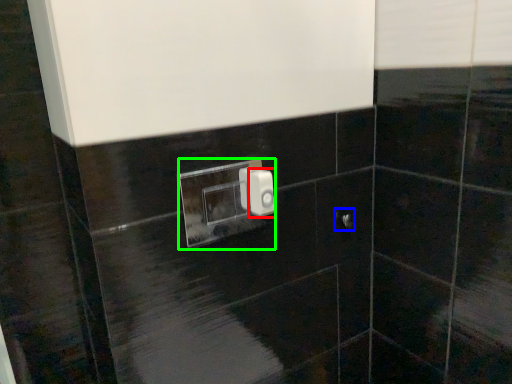
Question: Which object is positioned farthest from light switch (highlighted by a red box)? Select from door handle (highlighted by a blue box) and light switch (highlighted by a green box).

Choices:
 (A) door handle
 (B) light switch

Answer: (B)